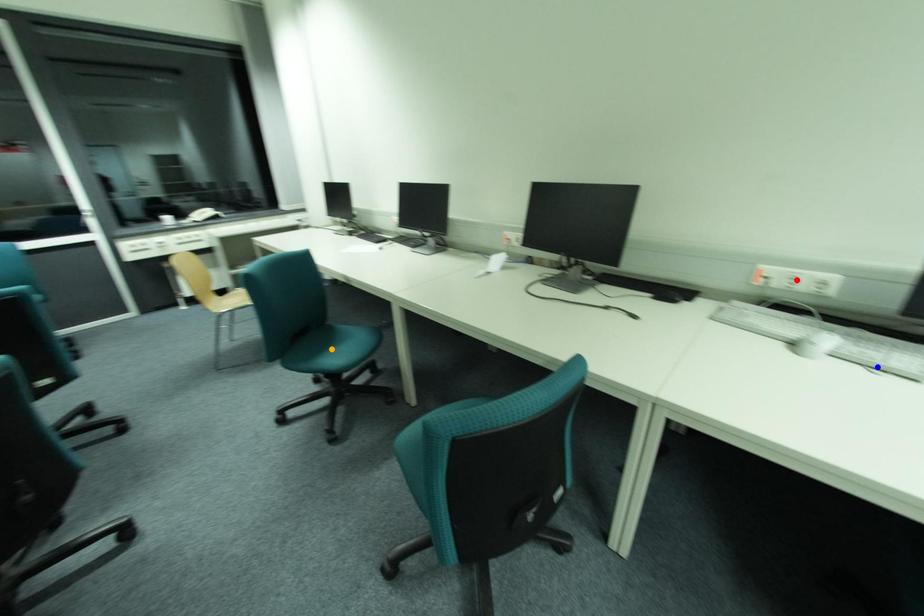
Order these from nearest to farthest:
red point
blue point
orange point

1. blue point
2. red point
3. orange point